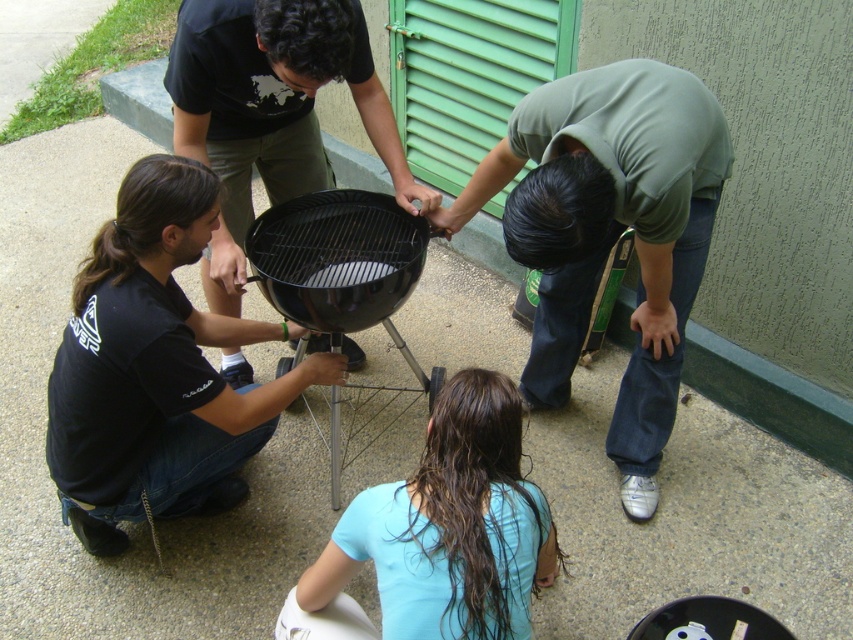
You are standing 6 feet away from the barbecue grill. You want to hand a tool to the person in the green matte shirt at center without moving closer than 6 feet. Is it possible?

The distance of green matte shirt at center from camera is 5.40 feet, so the person is within your 6 feet range. You can hand the tool without moving closer than 6 feet.

Based on the photo, you are standing at the barbecue grill and want to move towards the point labeled as point (248, 182). Which direction should you move relative to the other point labeled point (723, 129)?

Since point (723, 129) is in front of point (248, 182), you should move towards the direction behind point (723, 129) to reach point (248, 182).